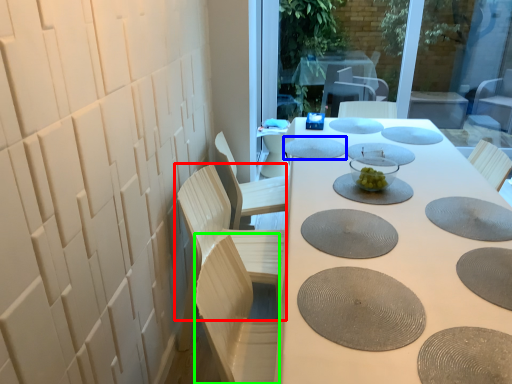
Question: Considering the real-world distances, which object is farthest from chair (highlighted by a red box)? manhole cover (highlighted by a blue box) or swivel chair (highlighted by a green box)?

Choices:
 (A) manhole cover
 (B) swivel chair

Answer: (A)